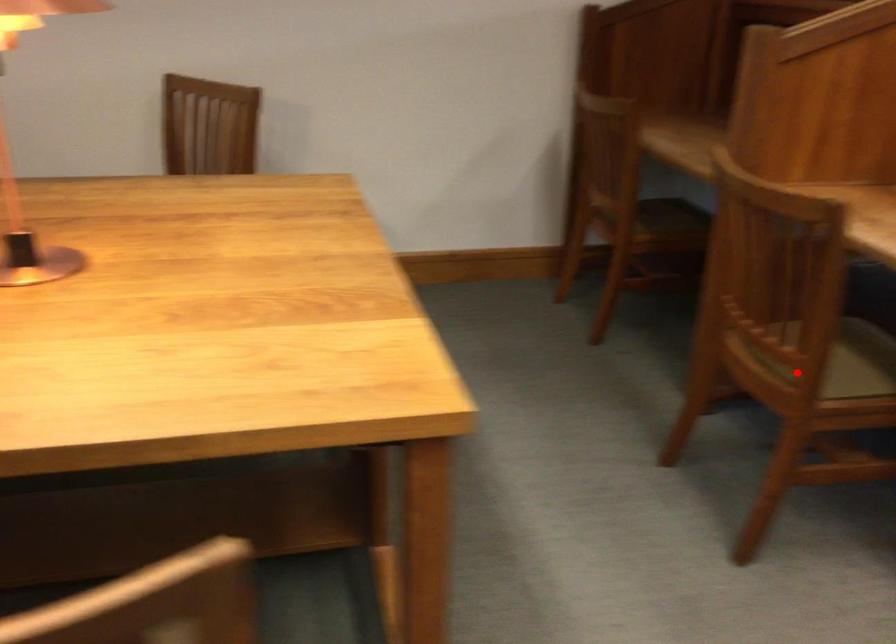
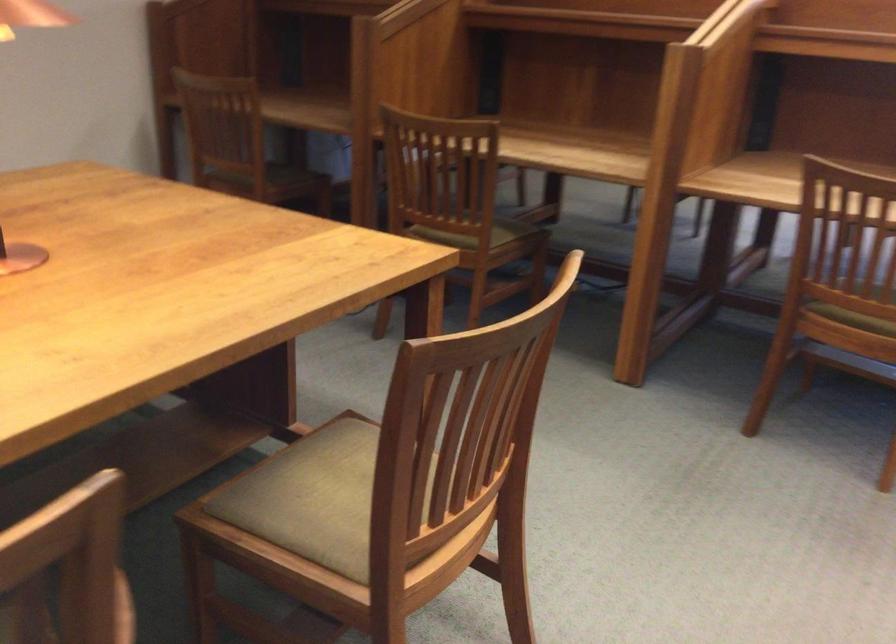
Find the pixel in the second image that matches the highlighted location in the first image.

(474, 234)